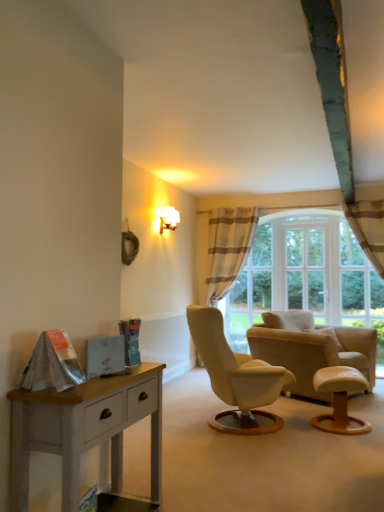
You are a GUI agent. You are given a task and a screenshot of the screen. Output one action in this format:
    pyautogui.click(x=<x>, y=<y>)
    Task: Click on the free space in front of light brown wooden stool at lower right
    
    Given the screenshot: What is the action you would take?
    pyautogui.click(x=346, y=445)